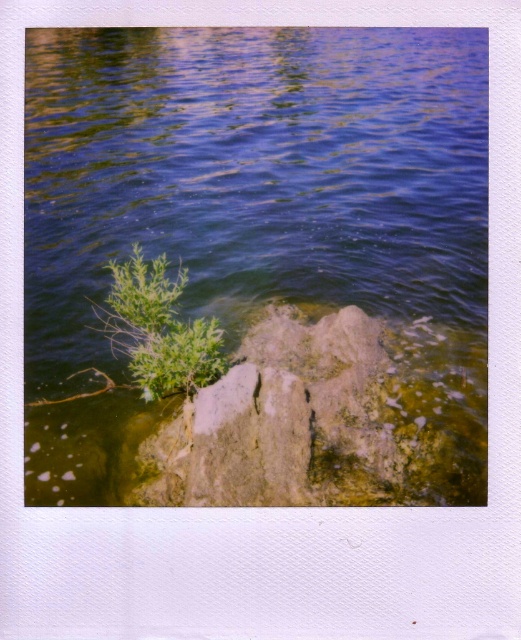
Between blue water at center and green leafy plant at upper left, which one has more height?

Standing taller between the two is blue water at center.

Can you confirm if blue water at center is smaller than green leafy plant at upper left?

Actually, blue water at center might be larger than green leafy plant at upper left.

Locate an element on the screen. blue water at center is located at coordinates (262, 260).